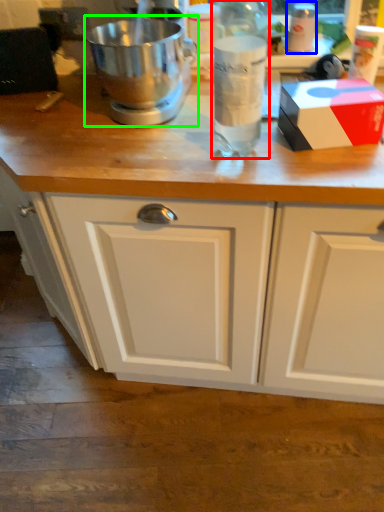
Question: Which is nearer to the bottle (highlighted by a red box)? bottle (highlighted by a blue box) or mixer (highlighted by a green box).

Choices:
 (A) bottle
 (B) mixer

Answer: (B)